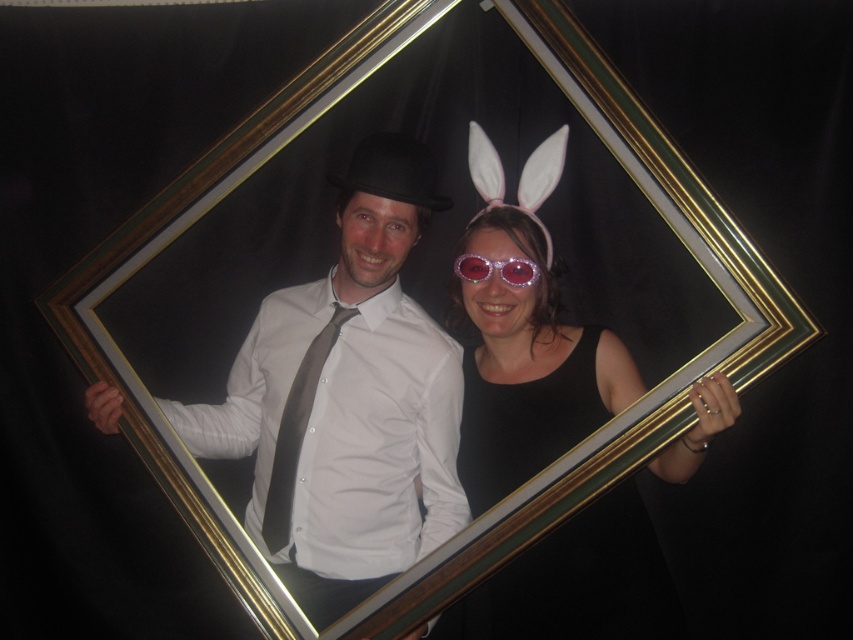
You are a tailor measuring accessories for a costume. You have a matte black bowler hat at center and a gray satin tie at center. Which accessory requires a larger measurement for its size?

The matte black bowler hat at center requires a larger measurement because it is bigger than the gray satin tie at center.

You are a photographer adjusting the lighting for a photo shoot. You notice the matte black bowler hat at center and the gray satin tie at center in the scene. Which object is closer to the camera lens?

The matte black bowler hat at center is in front of the gray satin tie at center, so it is closer to the camera lens.

You are an interior designer working on a virtual reality project. You need to place a virtual bowler hat in the exact 2D coordinates of the matte black bowler hat at center in the mirror. What are the coordinates you should use?

The coordinates for the matte black bowler hat at center are at point (346, 401).